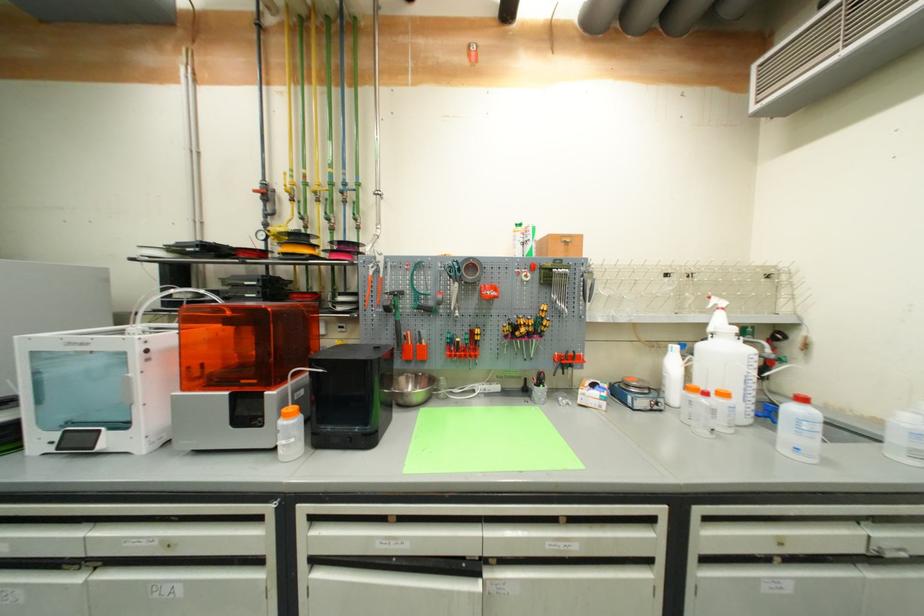
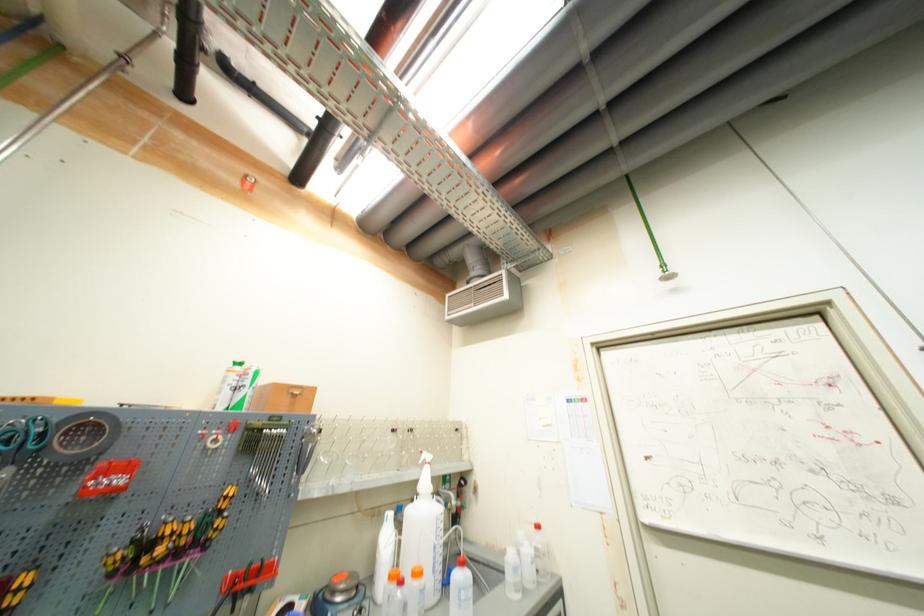
Where in the second image is the point corresponding to (x=525, y=325) from the first image?

(165, 537)